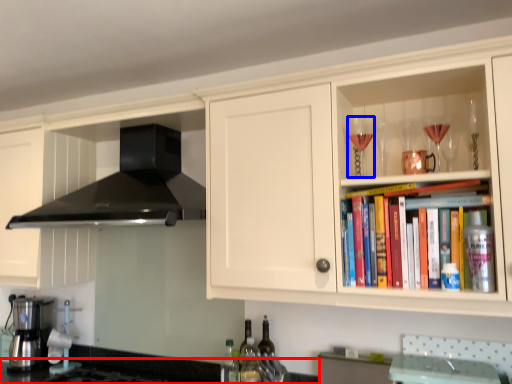
Question: Among these objects, which one is nearest to the camera, countertop (highlighted by a red box) or wine glass (highlighted by a blue box)?

Choices:
 (A) countertop
 (B) wine glass

Answer: (A)